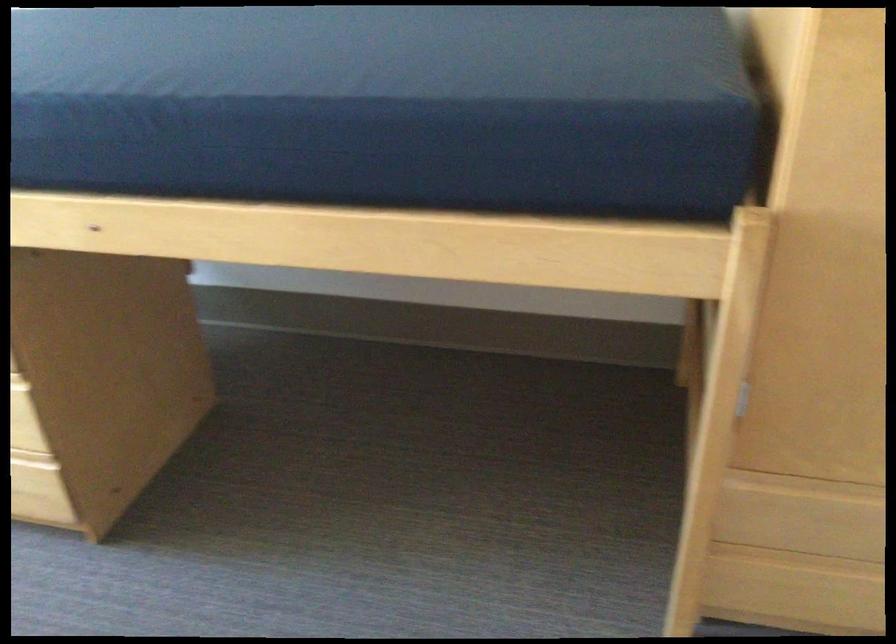
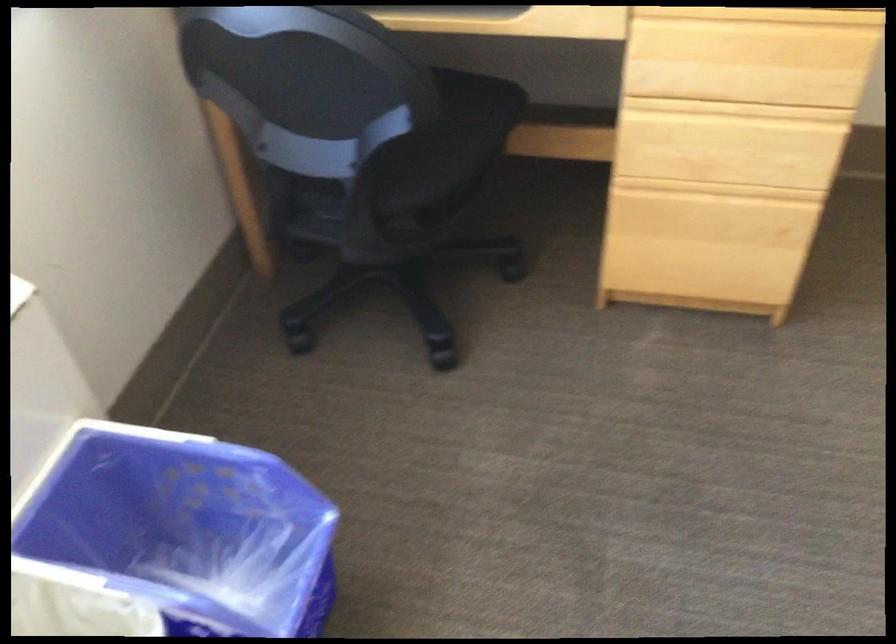
Question: In a continuous first-person perspective shot, in which direction is the camera moving?

Choices:
 (A) Left
 (B) Right
 (C) Forward
 (D) Backward

Answer: (A)